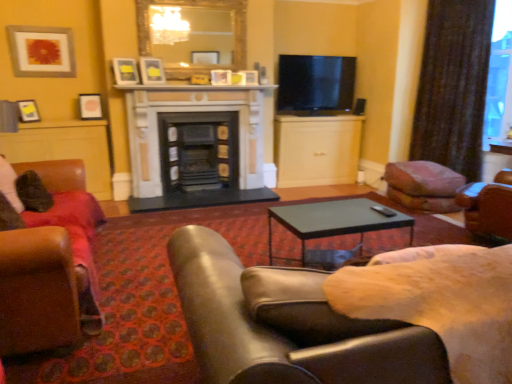
Question: Considering the relative sizes of matte black coffee table at center and brown leather chair at center, placed as the 2th chair when sorted from left to right, in the image provided, is matte black coffee table at center shorter than brown leather chair at center, placed as the 2th chair when sorted from left to right,?

Choices:
 (A) no
 (B) yes

Answer: (B)

Question: Is matte black coffee table at center behind brown leather chair at center, which ranks as the first chair in right-to-left order?

Choices:
 (A) no
 (B) yes

Answer: (B)

Question: Would you say matte black coffee table at center is a long distance from brown leather chair at center, placed as the 2th chair when sorted from left to right?

Choices:
 (A) no
 (B) yes

Answer: (B)

Question: From the image's perspective, is matte black coffee table at center located beneath brown leather chair at center, which ranks as the first chair in right-to-left order?

Choices:
 (A) yes
 (B) no

Answer: (B)

Question: From a real-world perspective, is matte black coffee table at center physically above brown leather chair at center, which ranks as the first chair in right-to-left order?

Choices:
 (A) yes
 (B) no

Answer: (B)

Question: Considering the relative positions of brown leather chair at center, which ranks as the first chair in right-to-left order, and matte black picture frame at upper center, which is the second picture frame from right to left, in the image provided, is brown leather chair at center, which ranks as the first chair in right-to-left order, to the left or to the right of matte black picture frame at upper center, which is the second picture frame from right to left,?

Choices:
 (A) right
 (B) left

Answer: (A)

Question: Looking at their shapes, would you say brown leather chair at center, which ranks as the first chair in right-to-left order, is wider or thinner than matte black picture frame at upper center, which is the second picture frame from right to left?

Choices:
 (A) thin
 (B) wide

Answer: (B)

Question: Is point (316, 382) positioned closer to the camera than point (117, 74)?

Choices:
 (A) closer
 (B) farther

Answer: (A)

Question: In terms of height, does brown leather chair at center, which ranks as the first chair in right-to-left order, look taller or shorter compared to matte black picture frame at upper center, which is the second picture frame from right to left?

Choices:
 (A) tall
 (B) short

Answer: (A)

Question: From their relative heights in the image, would you say matte gray picture frame at upper left, which appears as the first picture frame when viewed from the left, is taller or shorter than light wood cabinet at center?

Choices:
 (A) tall
 (B) short

Answer: (B)

Question: Looking at their shapes, would you say matte gray picture frame at upper left, the 4th picture frame viewed from the right, is wider or thinner than light wood cabinet at center?

Choices:
 (A) wide
 (B) thin

Answer: (B)

Question: Is matte gray picture frame at upper left, the 4th picture frame viewed from the right, bigger or smaller than light wood cabinet at center?

Choices:
 (A) small
 (B) big

Answer: (A)

Question: From the image's perspective, is matte gray picture frame at upper left, the 4th picture frame viewed from the right, located above or below light wood cabinet at center?

Choices:
 (A) above
 (B) below

Answer: (A)

Question: Is marble fireplace at center, which appears as the 1th fireplace when viewed from the right, bigger or smaller than matte black picture frame at upper center, acting as the 4th picture frame starting from the left?

Choices:
 (A) small
 (B) big

Answer: (B)

Question: From the image's perspective, is marble fireplace at center, the second fireplace positioned from the left, above or below matte black picture frame at upper center, acting as the 4th picture frame starting from the left?

Choices:
 (A) above
 (B) below

Answer: (B)